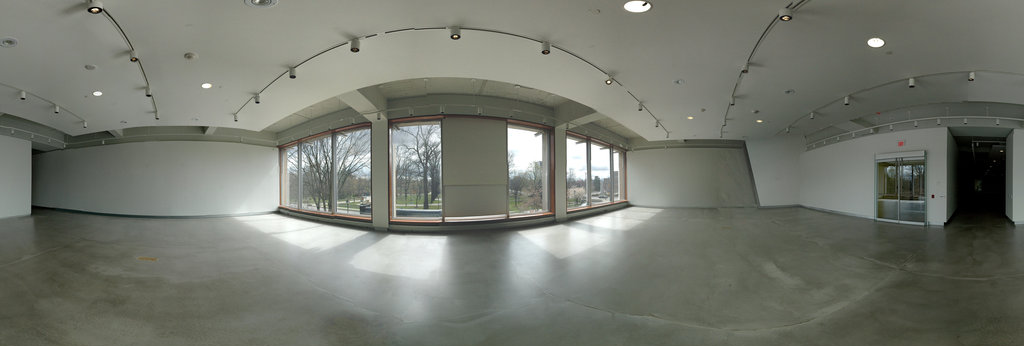
The height and width of the screenshot is (346, 1024). What are the coordinates of `floor inside hallway` in the screenshot? It's located at (979, 219).